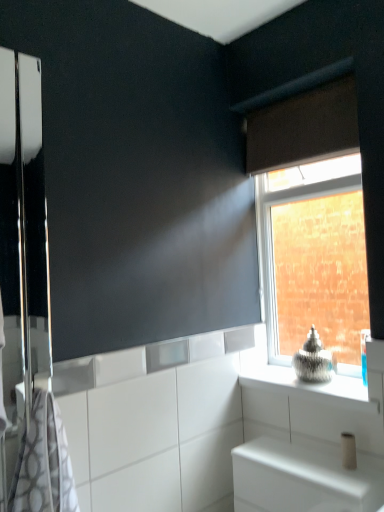
Question: Considering the relative sizes of white glossy cabinet at lower right and gray-patterned towel at left in the image provided, is white glossy cabinet at lower right shorter than gray-patterned towel at left?

Choices:
 (A) yes
 (B) no

Answer: (A)

Question: Does white glossy cabinet at lower right turn towards gray-patterned towel at left?

Choices:
 (A) no
 (B) yes

Answer: (A)

Question: Are white glossy cabinet at lower right and gray-patterned towel at left making contact?

Choices:
 (A) yes
 (B) no

Answer: (B)

Question: From a real-world perspective, is white glossy cabinet at lower right on gray-patterned towel at left?

Choices:
 (A) yes
 (B) no

Answer: (B)

Question: Is white glossy cabinet at lower right further to camera compared to gray-patterned towel at left?

Choices:
 (A) yes
 (B) no

Answer: (B)

Question: From the image's perspective, is white glossy cabinet at lower right beneath gray-patterned towel at left?

Choices:
 (A) no
 (B) yes

Answer: (B)

Question: Can you confirm if brown fabric curtain at upper right is wider than clear glass window at upper right?

Choices:
 (A) no
 (B) yes

Answer: (A)

Question: Does brown fabric curtain at upper right have a smaller size compared to clear glass window at upper right?

Choices:
 (A) no
 (B) yes

Answer: (B)

Question: Can you confirm if brown fabric curtain at upper right is positioned to the right of clear glass window at upper right?

Choices:
 (A) no
 (B) yes

Answer: (A)

Question: Can you confirm if brown fabric curtain at upper right is thinner than clear glass window at upper right?

Choices:
 (A) yes
 (B) no

Answer: (A)

Question: Is brown fabric curtain at upper right facing towards clear glass window at upper right?

Choices:
 (A) yes
 (B) no

Answer: (B)

Question: Is clear glass window at upper right surrounded by brown fabric curtain at upper right?

Choices:
 (A) yes
 (B) no

Answer: (B)

Question: Is gray-patterned towel at left not near white glossy cabinet at lower right?

Choices:
 (A) no
 (B) yes

Answer: (A)